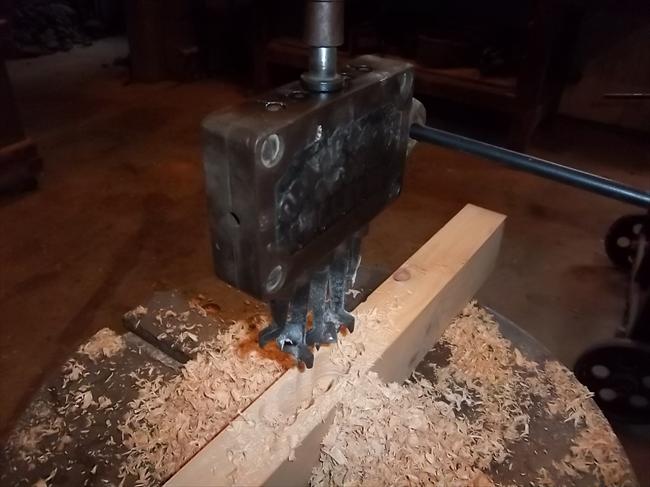
Image resolution: width=650 pixels, height=487 pixels. I want to click on workbench surface, so click(73, 413), click(538, 436).